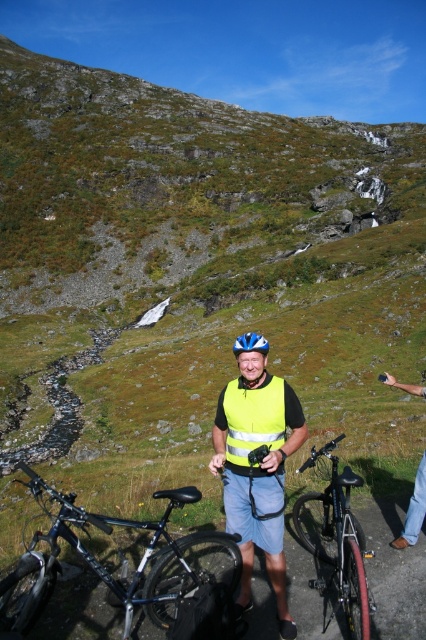
You are a hiker planning to take a photo of the two items at the center of the scene. You have a camera with a limited focus range. Which item should you focus on first if you want to ensure both items are in focus, given that the yellow reflective safety vest at center is closer to you than the blue matte helmet at center?

You should focus on the yellow reflective safety vest at center first because it is closer to you than the blue matte helmet at center. By focusing on the closer item, the depth of field may extend to include the farther item within the focus range.

You are a hiker who needs to place a 5.5 feet long backpack between the yellow reflective safety vest at center and the blue matte helmet at center. Is there enough space between them to fit the backpack?

The yellow reflective safety vest at center and blue matte helmet at center are 7.61 feet apart from each other, so yes, the backpack can be placed between them since it is shorter than the distance between the two items.